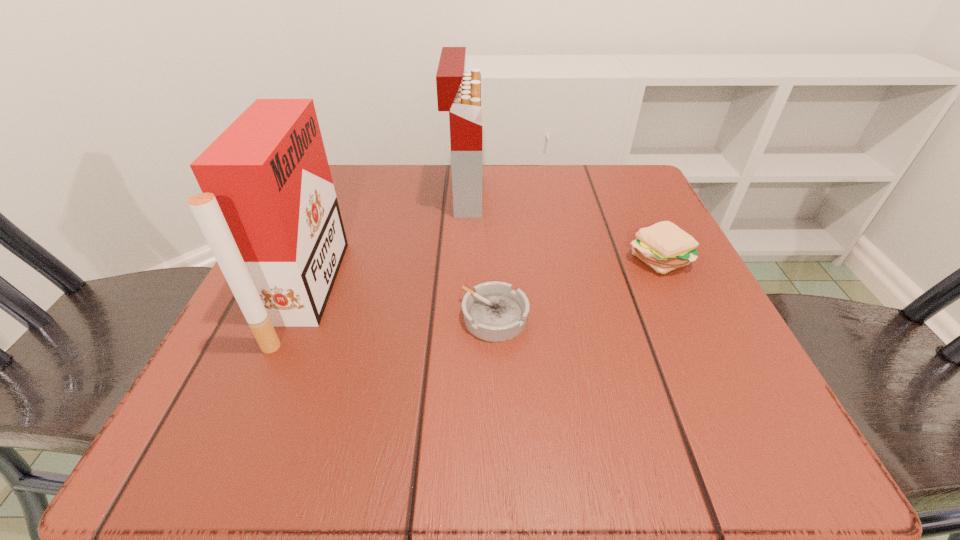
At what (x,y) coordinates should I click in order to perform the action: click on object identified as the closest to the shortest object. Please return your answer as a coordinate pair (x, y). Looking at the image, I should click on [x=663, y=246].

Point out which object is positioned as the third nearest to the leftmost object. Please provide its 2D coordinates. Your answer should be formatted as a tuple, i.e. [(x, y)], where the tuple contains the x and y coordinates of a point satisfying the conditions above.

[(663, 246)]

Locate an element on the screen. The height and width of the screenshot is (540, 960). free spot that satisfies the following two spatial constraints: 1. on the front-facing side of the nearer cigarette case; 2. on the left side of the shortest object is located at coordinates (296, 317).

Image resolution: width=960 pixels, height=540 pixels. What are the coordinates of `free region that satisfies the following two spatial constraints: 1. with the lid open on the third tallest object; 2. on the right side of the right cigarette case` in the screenshot? It's located at (462, 257).

This screenshot has width=960, height=540. I want to click on vacant space that satisfies the following two spatial constraints: 1. on the front side of the rightmost object; 2. on the front-facing side of the nearer cigarette case, so click(x=674, y=292).

Where is `free location that satisfies the following two spatial constraints: 1. on the front-facing side of the nearer cigarette case; 2. on the left side of the ashtray`? free location that satisfies the following two spatial constraints: 1. on the front-facing side of the nearer cigarette case; 2. on the left side of the ashtray is located at coordinates (296, 317).

Locate an element on the screen. Image resolution: width=960 pixels, height=540 pixels. vacant space that satisfies the following two spatial constraints: 1. with the lid open on the farthest object; 2. on the left side of the third tallest object is located at coordinates (462, 257).

Identify the location of vacant space that satisfies the following two spatial constraints: 1. on the front-facing side of the ashtray; 2. on the left side of the leftmost object. The width and height of the screenshot is (960, 540). (296, 317).

At what (x,y) coordinates should I click in order to perform the action: click on free spot that satisfies the following two spatial constraints: 1. with the lid open on the shortest object; 2. on the left side of the farthest object. Please return your answer as a coordinate pair (x, y). The height and width of the screenshot is (540, 960). Looking at the image, I should click on (459, 317).

Locate an element on the screen. This screenshot has width=960, height=540. vacant region that satisfies the following two spatial constraints: 1. on the front side of the rightmost object; 2. on the front-facing side of the nearer cigarette case is located at coordinates click(674, 292).